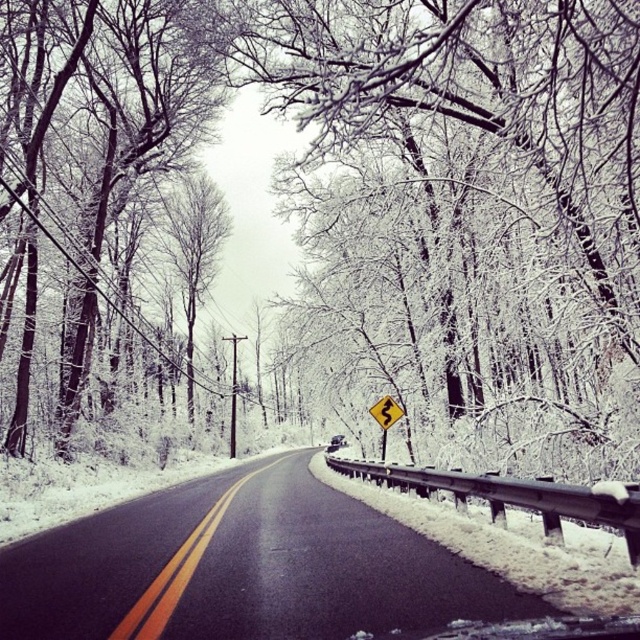
Question: Does black asphalt road at center have a larger size compared to yellow reflective plastic at center?

Choices:
 (A) no
 (B) yes

Answer: (B)

Question: Which point appears closest to the camera in this image?

Choices:
 (A) (378, 579)
 (B) (380, 397)
 (C) (106, 90)

Answer: (A)

Question: Which object is the closest to the white frosty tree at left?

Choices:
 (A) yellow reflective plastic at center
 (B) black asphalt road at center

Answer: (B)

Question: Can you confirm if white frosty tree at left is positioned to the left of yellow reflective plastic at center?

Choices:
 (A) yes
 (B) no

Answer: (A)

Question: From the image, what is the correct spatial relationship of black asphalt road at center in relation to white frosty tree at left?

Choices:
 (A) left
 (B) right

Answer: (B)

Question: Among these objects, which one is farthest from the camera?

Choices:
 (A) yellow reflective plastic at center
 (B) white frosty tree at left

Answer: (A)